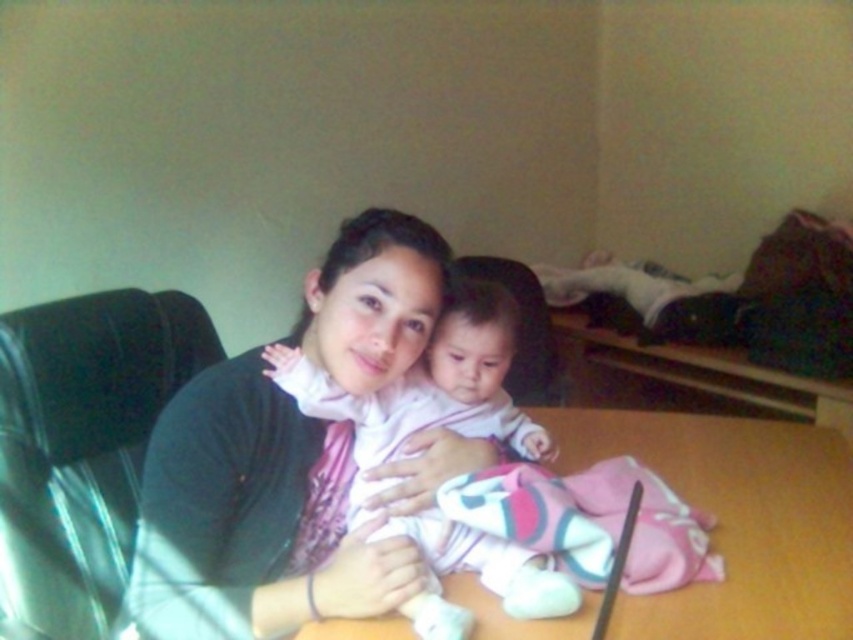
Can you confirm if wooden table at center is shorter than pink soft fabric baby at center?

Yes.

Can you confirm if wooden table at center is taller than pink soft fabric baby at center?

No.

Who is more distant from viewer, (837, 582) or (498, 568)?

The point (837, 582) is more distant.

You are a GUI agent. You are given a task and a screenshot of the screen. Output one action in this format:
    pyautogui.click(x=<x>, y=<y>)
    Task: Click on the wooden table at center
    This screenshot has height=640, width=853.
    Given the screenshot: What is the action you would take?
    [x=735, y=518]